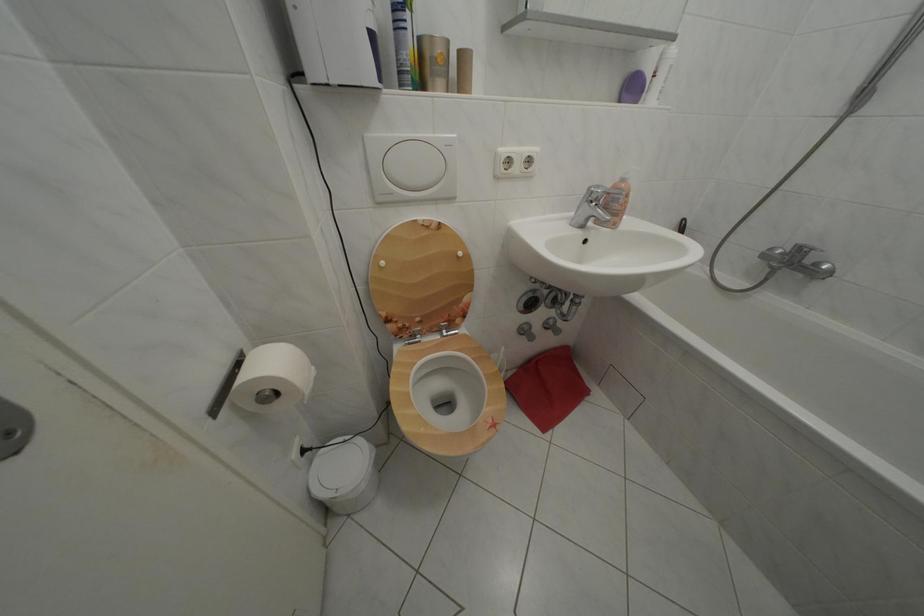
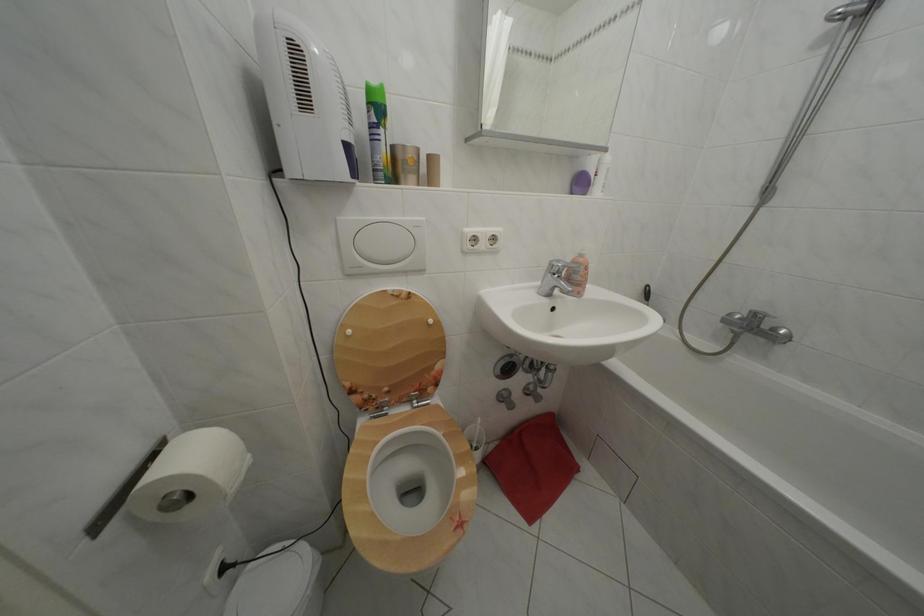
Question: In a continuous first-person perspective shot, in which direction is the camera moving?

Choices:
 (A) Left
 (B) Right
 (C) Forward
 (D) Backward

Answer: (B)